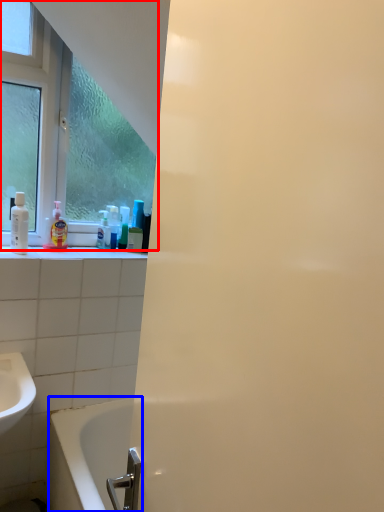
Question: Which object is closer to the camera taking this photo, window (highlighted by a red box) or bathtub (highlighted by a blue box)?

Choices:
 (A) window
 (B) bathtub

Answer: (B)